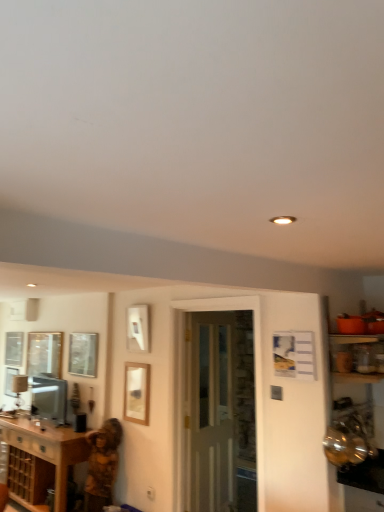
Question: Considering the positions of wooden picture frame at center and brown wood cabinet at lower left in the image, is wooden picture frame at center taller or shorter than brown wood cabinet at lower left?

Choices:
 (A) tall
 (B) short

Answer: (B)

Question: Is wooden picture frame at center wider or thinner than brown wood cabinet at lower left?

Choices:
 (A) wide
 (B) thin

Answer: (B)

Question: Which of these objects is positioned closest to the brown wood cabinet at lower left?

Choices:
 (A) clear glass window at upper center, which is the first window in front-to-back order
 (B) clear glass window at center, the 1th window positioned from the left
 (C) wooden picture frame at center
 (D) camouflage-patterned shirt at lower left
 (E) orange plastic bowls at right

Answer: (D)

Question: Which object is the closest to the clear glass door at center?

Choices:
 (A) clear glass window at upper center, placed as the second window when sorted from back to front
 (B) camouflage-patterned shirt at lower left
 (C) orange plastic bowls at right
 (D) wooden picture frame at center
 (E) brown wood cabinet at lower left

Answer: (D)